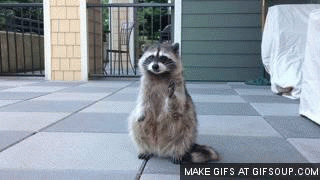
The image size is (320, 180). Find the location of `white trim`. white trim is located at coordinates (178, 25), (84, 31), (45, 26).